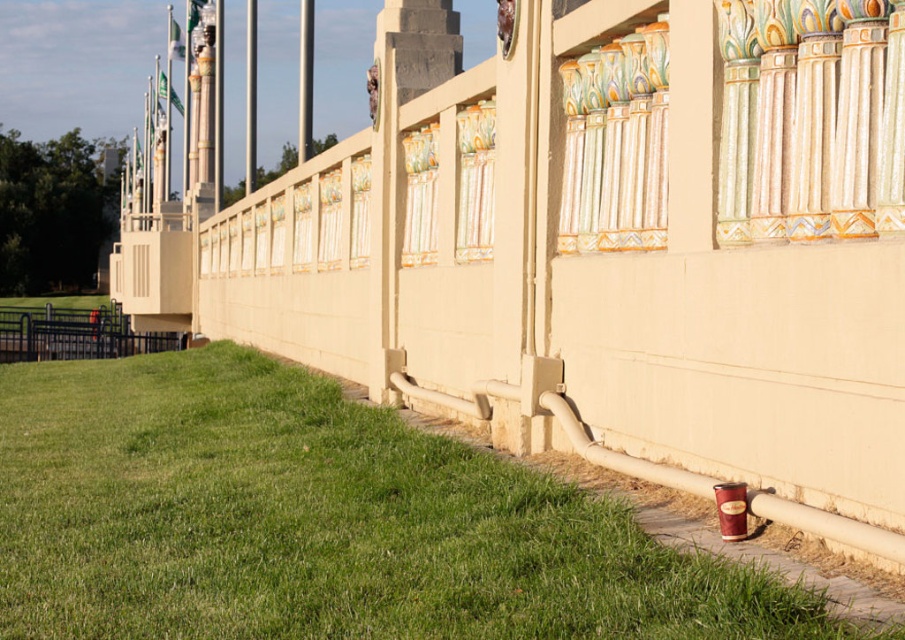
Question: Considering the relative positions of green grass at lower left and black metal fence at lower left in the image provided, where is green grass at lower left located with respect to black metal fence at lower left?

Choices:
 (A) left
 (B) right

Answer: (B)

Question: Which point appears closest to the camera in this image?

Choices:
 (A) (11, 307)
 (B) (24, 428)

Answer: (B)

Question: In this image, where is green grass at lower left located relative to black metal fence at lower left?

Choices:
 (A) right
 (B) left

Answer: (A)

Question: Which point appears closest to the camera in this image?

Choices:
 (A) (287, 442)
 (B) (32, 333)

Answer: (A)

Question: Which object is farther from the camera taking this photo?

Choices:
 (A) black metal fence at lower left
 (B) green grass at lower left

Answer: (A)

Question: Can you confirm if green grass at lower left is positioned to the right of black metal fence at lower left?

Choices:
 (A) yes
 (B) no

Answer: (A)